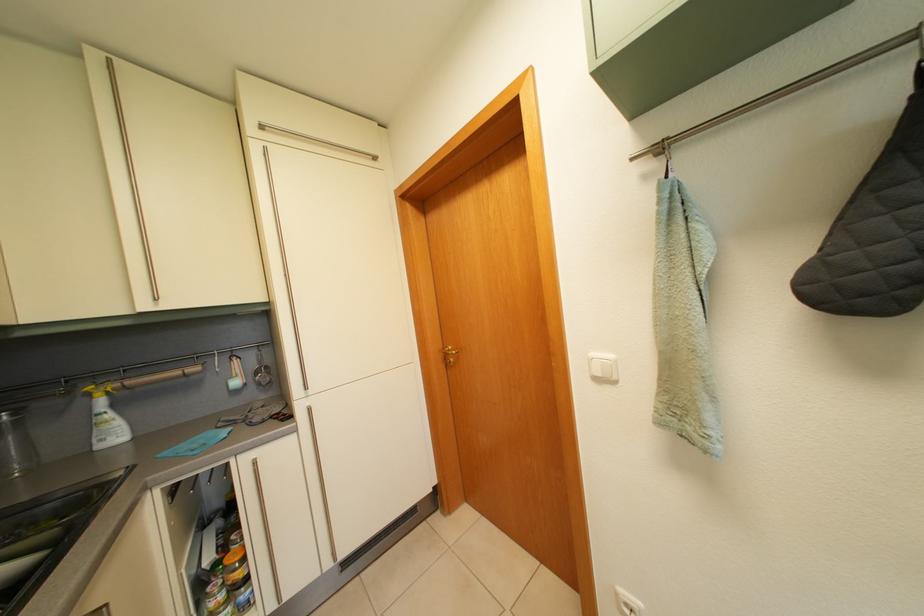
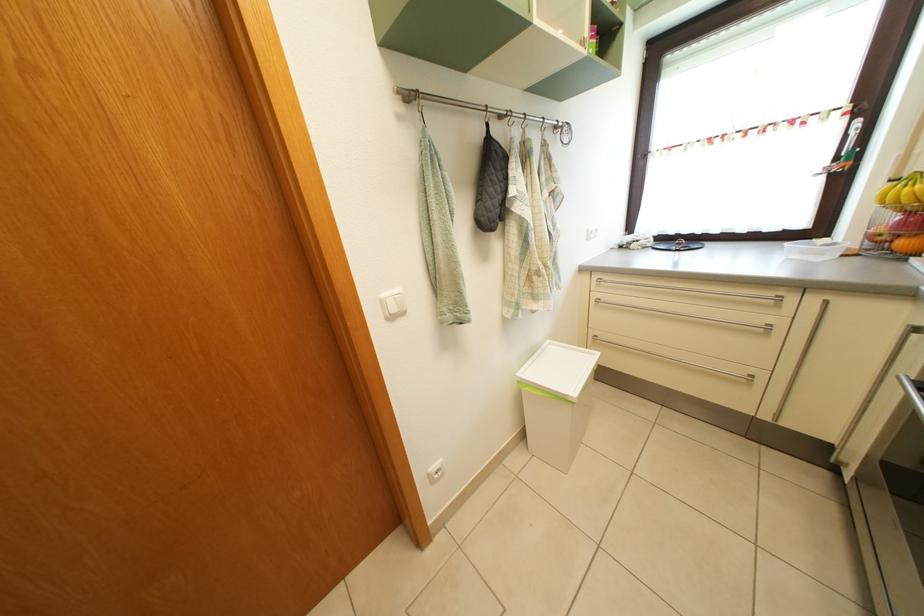
Find the pixel in the second image that matches (601,362) in the first image.

(392, 302)